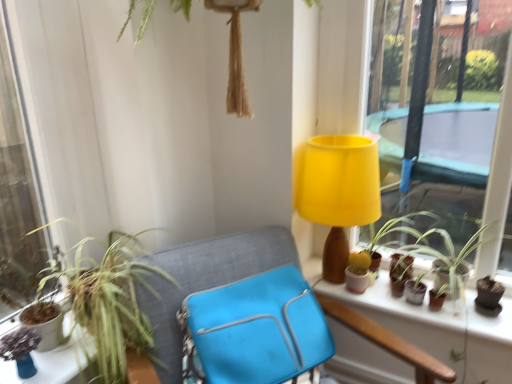
At what (x,y) coordinates should I click in order to perform the action: click on free location above matte brown window sill at upper right (from a real-world perspective). Please return your answer as a coordinate pair (x, y). Image resolution: width=512 pixels, height=384 pixels. Looking at the image, I should click on (403, 280).